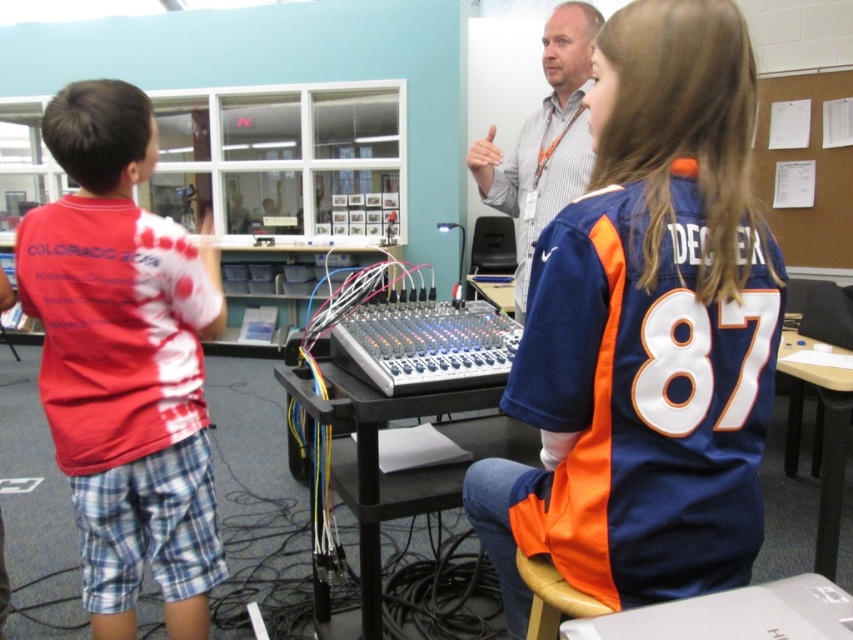
Is blue/orange jersey at center positioned behind striped shirt at upper center?

No, blue/orange jersey at center is closer to the viewer.

Is the position of blue/orange jersey at center less distant than that of striped shirt at upper center?

Yes, it is.

Does point (666, 509) come farther from viewer compared to point (564, 96)?

No.

Locate an element on the screen. This screenshot has width=853, height=640. blue/orange jersey at center is located at coordinates (646, 332).

Can you confirm if tie-dye t-shirt at left is taller than striped shirt at upper center?

Yes.

Which is behind, point (102, 486) or point (474, 164)?

Positioned behind is point (474, 164).

Locate an element on the screen. tie-dye t-shirt at left is located at coordinates (125, 362).

What are the coordinates of `tie-dye t-shirt at left` in the screenshot? It's located at (125, 362).

Who is higher up, blue/orange jersey at center or tie-dye t-shirt at left?

tie-dye t-shirt at left

The image size is (853, 640). In order to click on blue/orange jersey at center in this screenshot , I will do `click(646, 332)`.